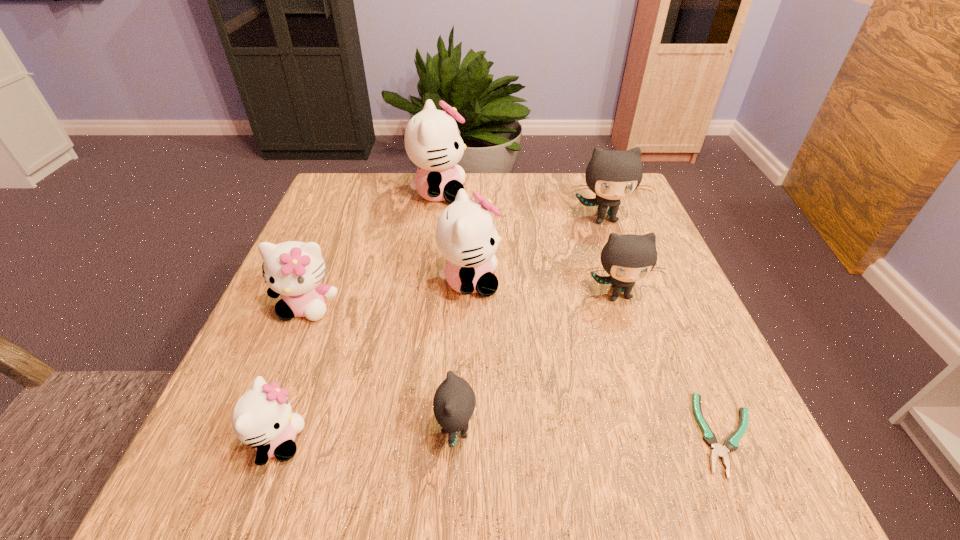
The image size is (960, 540). Find the location of `pliers that is at the right edge`. pliers that is at the right edge is located at coordinates (731, 443).

Identify the location of object present at the near left corner. The width and height of the screenshot is (960, 540). (262, 417).

Image resolution: width=960 pixels, height=540 pixels. In order to click on object located at the far right corner in this screenshot , I will do `click(612, 175)`.

The image size is (960, 540). Find the location of `object located at the near right corner`. object located at the near right corner is located at coordinates (731, 443).

At what (x,y) coordinates should I click in order to perform the action: click on free space at the far edge of the desktop. Please return your answer as a coordinate pair (x, y). Looking at the image, I should click on [x=402, y=199].

In the image, there is a desktop. Where is `vacant space at the near edge`? This screenshot has height=540, width=960. vacant space at the near edge is located at coordinates (506, 504).

Where is `free location at the left edge`? free location at the left edge is located at coordinates (338, 228).

Locate an element on the screen. This screenshot has width=960, height=540. blank space at the near left corner is located at coordinates (243, 446).

Image resolution: width=960 pixels, height=540 pixels. In order to click on free space at the near right corner of the desktop in this screenshot , I will do `click(724, 465)`.

Where is `free spot between the third biggest white kitten and the teal pliers`? free spot between the third biggest white kitten and the teal pliers is located at coordinates (516, 370).